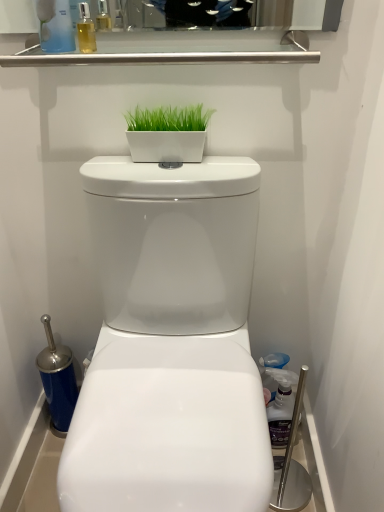
I want to click on free spot in front of green matte planter at center, so click(x=174, y=174).